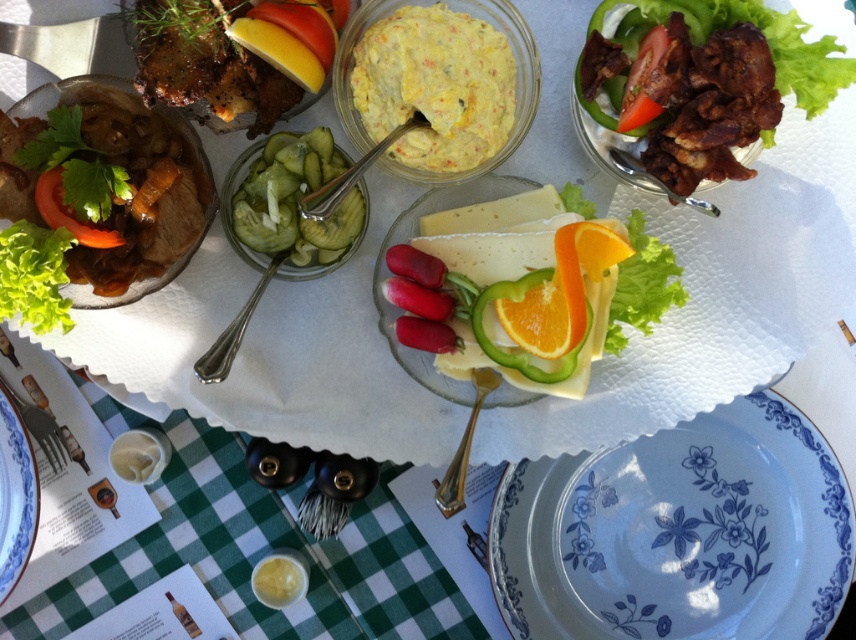
Is green leafy salad at left further to camera compared to blue floral plate at lower right?

No.

Is green leafy salad at left thinner than blue floral plate at lower right?

Incorrect, green leafy salad at left's width is not less than blue floral plate at lower right's.

Where is `green leafy salad at left`? This screenshot has height=640, width=856. green leafy salad at left is located at coordinates (181, 253).

How distant is shiny brown bacon at upper right from blue floral plate at lower right?

shiny brown bacon at upper right is 22.94 inches away from blue floral plate at lower right.

Which is in front, point (681, 4) or point (21, 481)?

Point (681, 4) is more forward.

Between point (676, 51) and point (0, 538), which one is positioned in front?

Point (676, 51) is in front.

Locate an element on the screen. The height and width of the screenshot is (640, 856). shiny brown bacon at upper right is located at coordinates (696, 84).

Does yellow creamy spread at center have a smaller size compared to green leafy salad at left?

Indeed, yellow creamy spread at center has a smaller size compared to green leafy salad at left.

Is yellow creamy spread at center positioned at the back of green leafy salad at left?

Yes, yellow creamy spread at center is further from the viewer.

Describe the element at coordinates (435, 86) in the screenshot. I see `yellow creamy spread at center` at that location.

You are a GUI agent. You are given a task and a screenshot of the screen. Output one action in this format:
    pyautogui.click(x=<x>, y=<y>)
    Task: Click on the yellow creamy spread at center
    
    Given the screenshot: What is the action you would take?
    pyautogui.click(x=435, y=86)